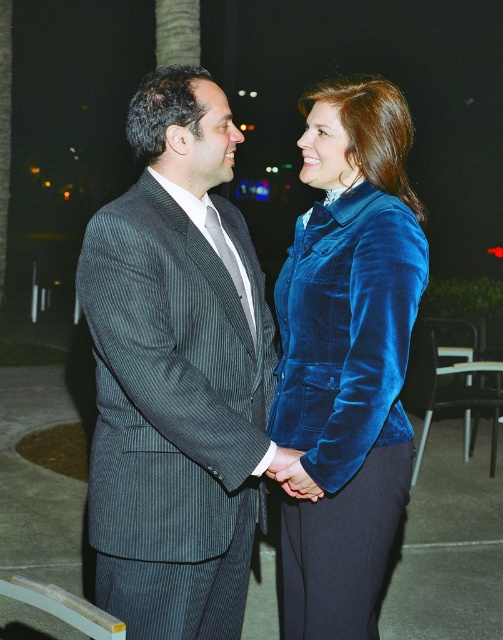
Question: Based on their relative distances, which object is farther from the pinstriped suit at center?

Choices:
 (A) velvet blue hand at center
 (B) velvet blue jacket at center

Answer: (A)

Question: Among these points, which one is farthest from the camera?

Choices:
 (A) (125, 428)
 (B) (341, 141)

Answer: (B)

Question: Based on their relative distances, which object is nearer to the pinstriped suit at center?

Choices:
 (A) velvet blue jacket at center
 (B) velvet blue hand at center

Answer: (A)

Question: Can you confirm if pinstriped suit at center is smaller than velvet blue hand at center?

Choices:
 (A) yes
 (B) no

Answer: (B)

Question: Is pinstriped suit at center closer to the viewer compared to velvet blue jacket at center?

Choices:
 (A) yes
 (B) no

Answer: (A)

Question: Is velvet blue jacket at center further to camera compared to velvet blue hand at center?

Choices:
 (A) no
 (B) yes

Answer: (A)